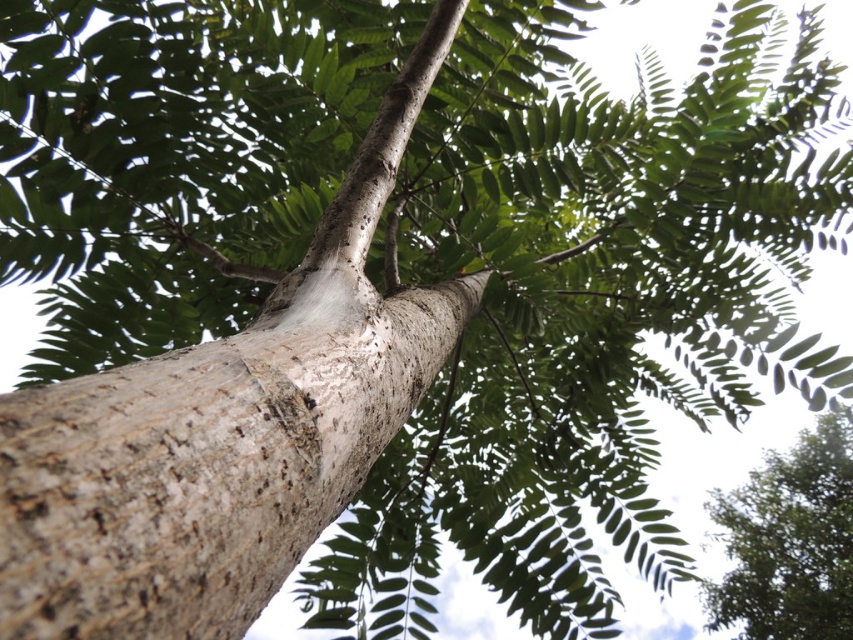
You are an arborist inspecting two trees in a park. You notice the smooth bark tree trunk at center and the green rough bark tree at upper right. Which tree is positioned to the right when viewed from your perspective?

The green rough bark tree at upper right is positioned to the right of the smooth bark tree trunk at center.

You are a bird looking for a place to perch. You see the smooth bark tree trunk at center and the green rough bark tree at upper right. Which tree is closer to you?

The smooth bark tree trunk at center is closer to you because it is in front of the green rough bark tree at upper right.

You are standing directly in front of the tree and want to touch the smooth bark tree trunk at center. Based on its position, where should you aim your hand to reach it?

The smooth bark tree trunk at center is located at point 0.722 in the x coordinate and 0.245 in the y coordinate, so you should aim your hand towards that specific coordinate to reach it.